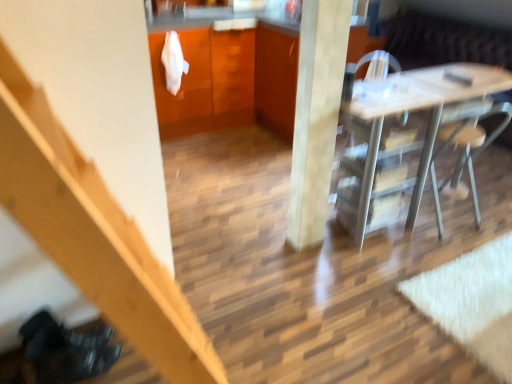
Question: Is glossy wood cabinetry at center, the second cabinetry in the right-to-left sequence, wider or thinner than metallic silver chair at right?

Choices:
 (A) wide
 (B) thin

Answer: (A)

Question: Does point (162, 69) appear closer or farther from the camera than point (487, 135)?

Choices:
 (A) farther
 (B) closer

Answer: (B)

Question: Estimate the real-world distances between objects in this image. Which object is farther from the metallic silver chair at right?

Choices:
 (A) smooth light wood pillar at center
 (B) glossy wood cabinetry at center, the second cabinetry in the right-to-left sequence
 (C) wooden stairs at left
 (D) white glossy desk at center
 (E) wooden cabinet at center, positioned as the 2th cabinetry in left-to-right order

Answer: (C)

Question: Which of these objects is positioned closest to the wooden stairs at left?

Choices:
 (A) smooth light wood pillar at center
 (B) white glossy desk at center
 (C) glossy wood cabinetry at center, the second cabinetry in the right-to-left sequence
 (D) metallic silver chair at right
 (E) matte wood dresser at upper center

Answer: (A)